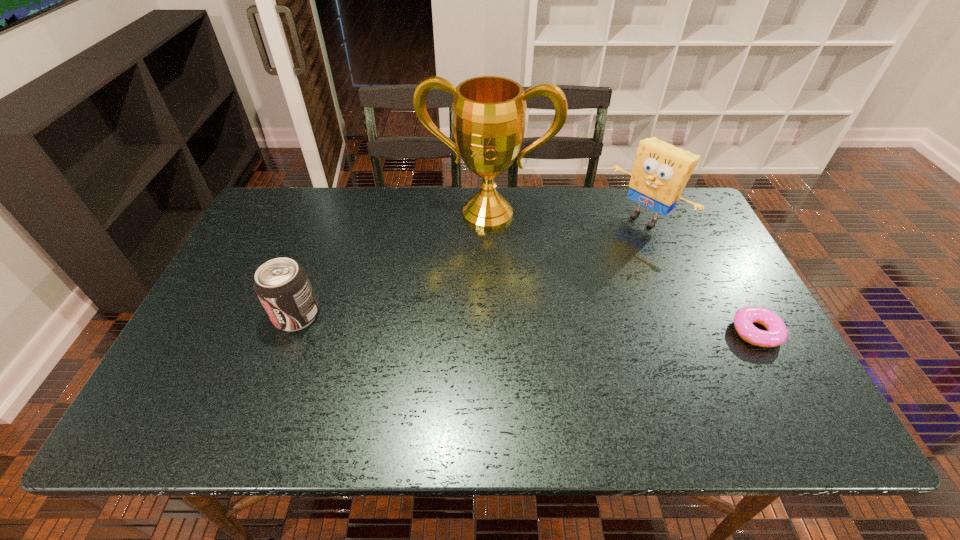
Find the location of a particular element. vacant spot on the desktop that is between the soda can and the doughnut and is positioned on the front-facing side of the third object from right to left is located at coordinates (462, 321).

The height and width of the screenshot is (540, 960). I want to click on free spot on the desktop that is between the soda can and the shortest object and is positioned on the face of the sponge, so click(x=514, y=323).